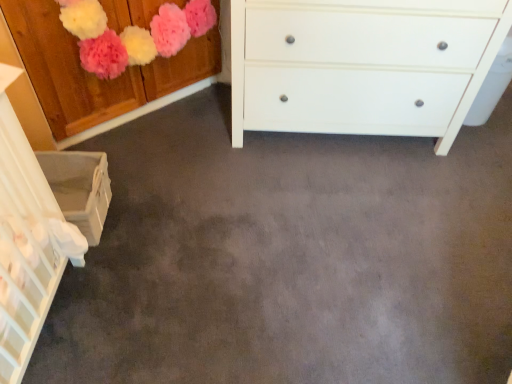
Question: From a real-world perspective, is white matte chest of drawers at center physically above white woven basket at lower left, the 1th cabinetry ordered from the bottom?

Choices:
 (A) no
 (B) yes

Answer: (B)

Question: Can you confirm if white matte chest of drawers at center is bigger than white woven basket at lower left, the 1th cabinetry ordered from the bottom?

Choices:
 (A) no
 (B) yes

Answer: (B)

Question: From the image's perspective, is white matte chest of drawers at center below white woven basket at lower left, the 1th cabinetry ordered from the bottom?

Choices:
 (A) yes
 (B) no

Answer: (B)

Question: Is white matte chest of drawers at center further to camera compared to white woven basket at lower left, which is the 2th cabinetry from top to bottom?

Choices:
 (A) yes
 (B) no

Answer: (A)

Question: Is white woven basket at lower left, which is the 2th cabinetry from top to bottom, at the back of white matte chest of drawers at center?

Choices:
 (A) no
 (B) yes

Answer: (A)

Question: Considering the relative sizes of white matte chest of drawers at center and white woven basket at lower left, the 1th cabinetry ordered from the bottom, in the image provided, is white matte chest of drawers at center wider than white woven basket at lower left, the 1th cabinetry ordered from the bottom,?

Choices:
 (A) yes
 (B) no

Answer: (A)

Question: Is white matte chest of drawers at center wider than wooden cabinet at upper left, the 1th cabinetry positioned from the top?

Choices:
 (A) yes
 (B) no

Answer: (A)

Question: From a real-world perspective, is white matte chest of drawers at center on wooden cabinet at upper left, the second cabinetry in the bottom-to-top sequence?

Choices:
 (A) no
 (B) yes

Answer: (A)

Question: Is white matte chest of drawers at center positioned beyond the bounds of wooden cabinet at upper left, the second cabinetry in the bottom-to-top sequence?

Choices:
 (A) yes
 (B) no

Answer: (A)

Question: Would you say white matte chest of drawers at center contains wooden cabinet at upper left, the 1th cabinetry positioned from the top?

Choices:
 (A) no
 (B) yes

Answer: (A)

Question: Is white matte chest of drawers at center facing towards wooden cabinet at upper left, the 1th cabinetry positioned from the top?

Choices:
 (A) yes
 (B) no

Answer: (B)

Question: Considering the relative positions of white matte chest of drawers at center and wooden cabinet at upper left, the second cabinetry in the bottom-to-top sequence, in the image provided, is white matte chest of drawers at center to the right of wooden cabinet at upper left, the second cabinetry in the bottom-to-top sequence, from the viewer's perspective?

Choices:
 (A) no
 (B) yes

Answer: (B)

Question: Is wooden cabinet at upper left, the 1th cabinetry positioned from the top, thinner than white woven basket at lower left, the 1th cabinetry ordered from the bottom?

Choices:
 (A) no
 (B) yes

Answer: (B)